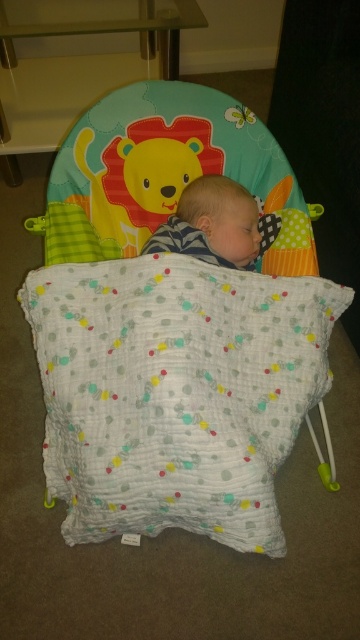
Does point (186, 177) come behind point (167, 230)?

Yes.

At what (x,y) coordinates should I click in order to perform the action: click on soft cotton baby bed at center. Please return your answer as a coordinate pair (x, y). Looking at the image, I should click on (173, 324).